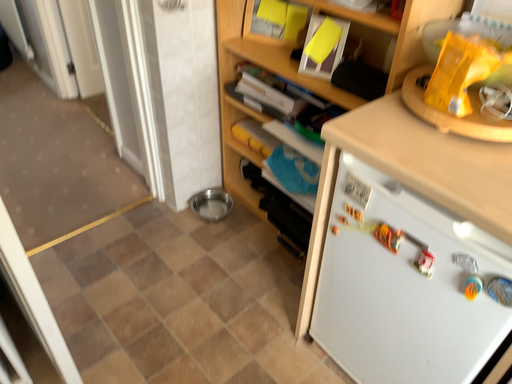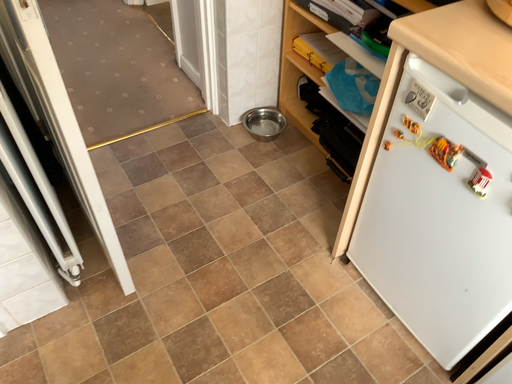
Question: How did the camera likely rotate when shooting the video?

Choices:
 (A) rotated right
 (B) rotated left

Answer: (B)